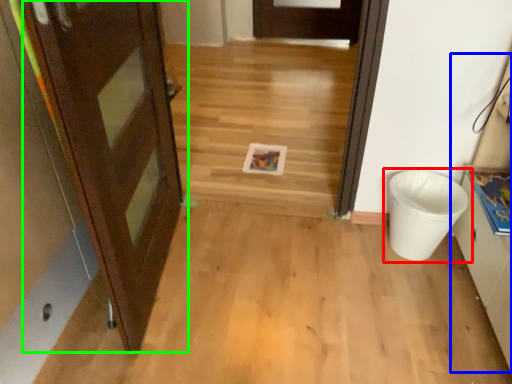
Question: Which object is the closest to the waste container (highlighted by a red box)? Choose among these: cabinetry (highlighted by a blue box) or door (highlighted by a green box).

Choices:
 (A) cabinetry
 (B) door

Answer: (A)